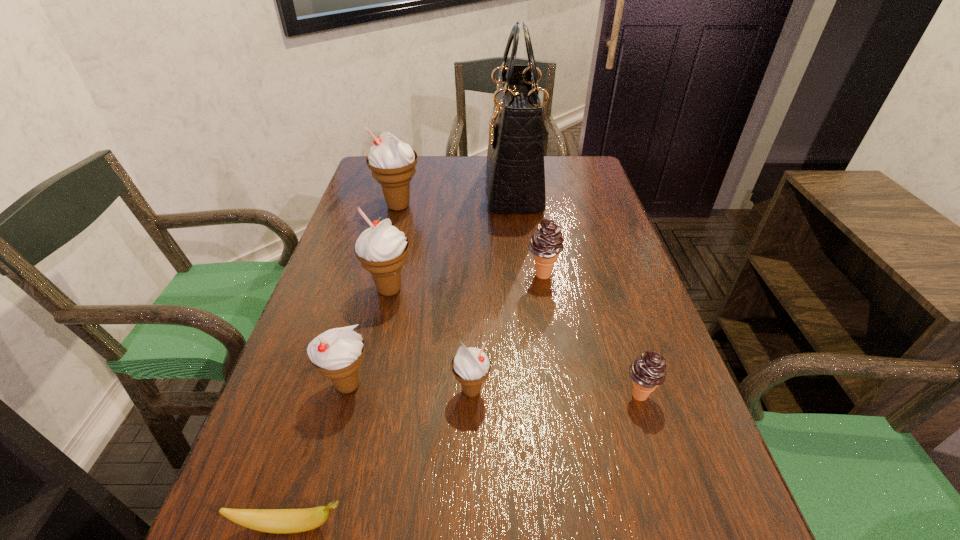
Find the location of a particular element. This screenshot has width=960, height=540. vacant area located 0.160m on the front of the third biggest white icecream is located at coordinates point(318,498).

At what (x,y) coordinates should I click in order to perform the action: click on vacant space located 0.300m on the back of the rightmost white icecream. Please return your answer as a coordinate pair (x, y). The image size is (960, 540). Looking at the image, I should click on (473, 274).

What are the coordinates of `vacant space located 0.050m on the front of the rightmost object` in the screenshot? It's located at (651, 434).

Find the location of a particular element. This screenshot has width=960, height=540. free region located at the stem of the nearest object is located at coordinates (520, 525).

Where is `object located at the far edge`? The image size is (960, 540). object located at the far edge is located at coordinates pos(515,158).

Where is `banana that is positioned at the left edge`? The image size is (960, 540). banana that is positioned at the left edge is located at coordinates (279, 521).

Find the location of a particular element. Image resolution: width=960 pixels, height=540 pixels. object located in the right edge section of the desktop is located at coordinates (648, 371).

This screenshot has height=540, width=960. What are the coordinates of `free location at the far edge of the desktop` in the screenshot? It's located at (428, 177).

Find the location of `blank space at the left edge of the desktop`. blank space at the left edge of the desktop is located at coordinates (285, 408).

In the image, there is a desktop. Where is `vacant space at the right edge`? This screenshot has width=960, height=540. vacant space at the right edge is located at coordinates (599, 225).